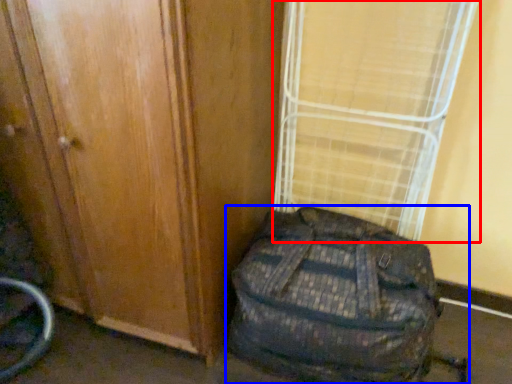
Question: Which point is closer to the camera, curtain (highlighted by a red box) or backpack (highlighted by a blue box)?

Choices:
 (A) curtain
 (B) backpack

Answer: (B)